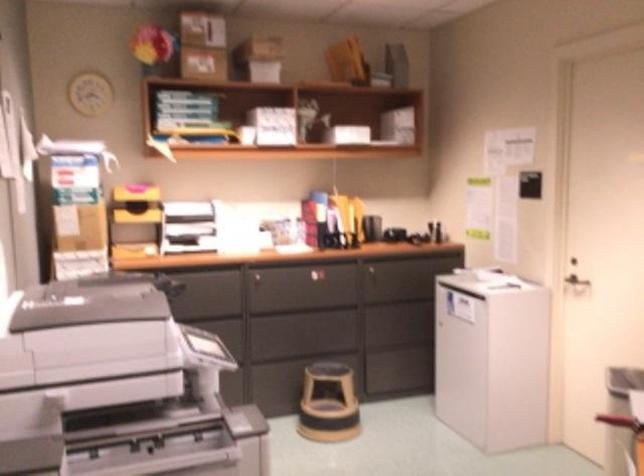
The image size is (644, 476). In order to click on printer feeder lid in this screenshot , I will do `click(89, 301)`.